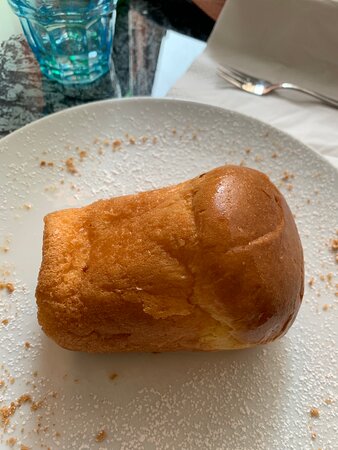
This screenshot has height=450, width=338. In order to click on marble in this screenshot , I will do `click(135, 78)`.